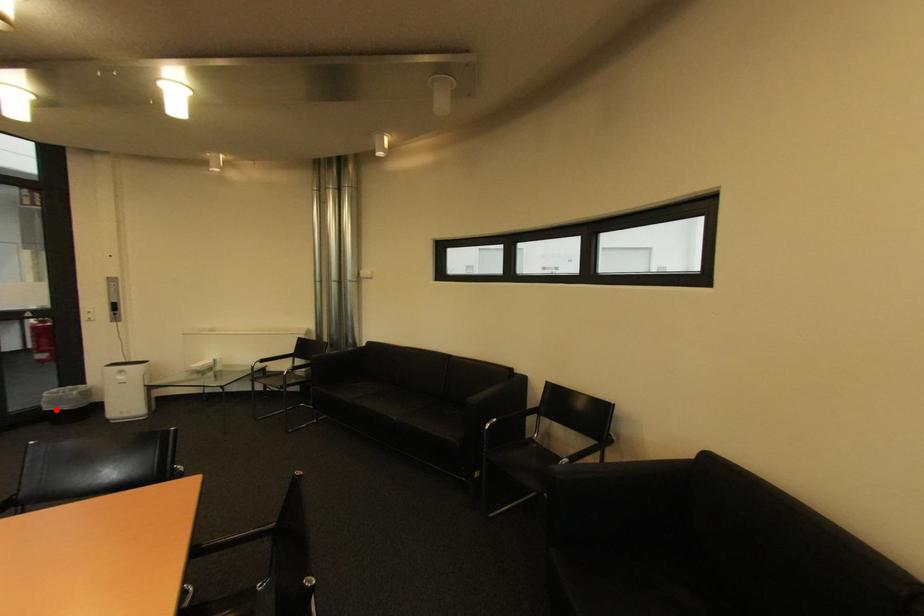
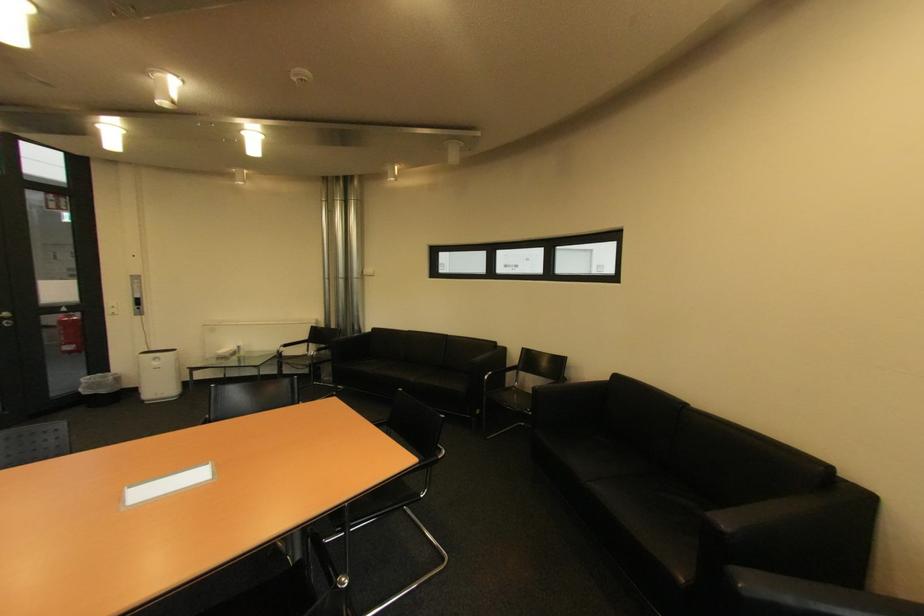
Question: I am providing you with two images of the same scene from different viewpoints. In image1, a red point is highlighted. Considering the same 3D point in image2, which of the following is correct?

Choices:
 (A) It is closer
 (B) It is farther

Answer: (A)